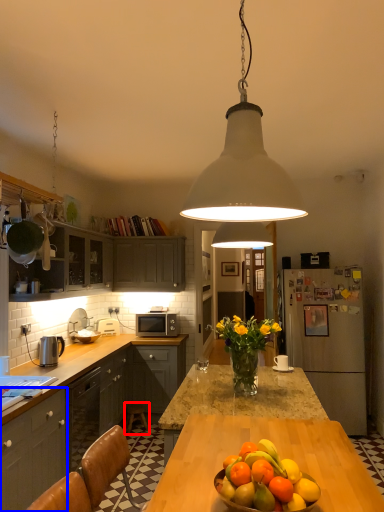
Question: Which point is closer to the camera, chair (highlighted by a red box) or cabinetry (highlighted by a blue box)?

Choices:
 (A) chair
 (B) cabinetry

Answer: (B)